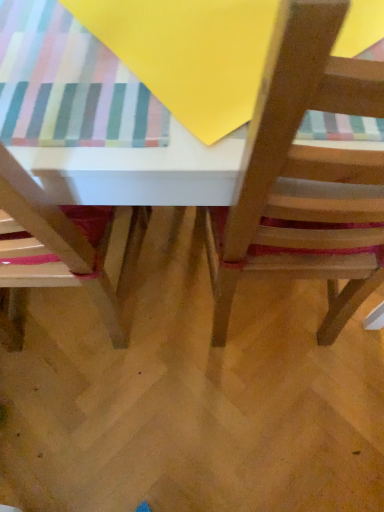
Question: Is wooden table at center taller than wooden chair at center, placed as the second chair when sorted from left to right?

Choices:
 (A) yes
 (B) no

Answer: (B)

Question: Is wooden table at center with wooden chair at center, which is the first chair in right-to-left order?

Choices:
 (A) yes
 (B) no

Answer: (A)

Question: From the image's perspective, is wooden table at center under wooden chair at center, placed as the second chair when sorted from left to right?

Choices:
 (A) no
 (B) yes

Answer: (A)

Question: Is wooden table at center far from wooden chair at center, placed as the second chair when sorted from left to right?

Choices:
 (A) yes
 (B) no

Answer: (B)

Question: From a real-world perspective, is wooden table at center positioned under wooden chair at center, placed as the second chair when sorted from left to right, based on gravity?

Choices:
 (A) no
 (B) yes

Answer: (B)

Question: From a real-world perspective, is wooden chair at center, which is the first chair in right-to-left order, above or below wooden chair at lower left, which is the second chair in right-to-left order?

Choices:
 (A) below
 (B) above

Answer: (B)

Question: From the image's perspective, is wooden chair at center, which is the first chair in right-to-left order, positioned above or below wooden chair at lower left, which appears as the 1th chair when viewed from the left?

Choices:
 (A) above
 (B) below

Answer: (A)

Question: Is wooden chair at center, placed as the second chair when sorted from left to right, inside or outside of wooden chair at lower left, which is the second chair in right-to-left order?

Choices:
 (A) inside
 (B) outside

Answer: (B)

Question: Relative to wooden chair at lower left, which is the second chair in right-to-left order, is wooden chair at center, which is the first chair in right-to-left order, in front or behind?

Choices:
 (A) front
 (B) behind

Answer: (A)

Question: In terms of height, does wooden chair at lower left, which appears as the 1th chair when viewed from the left, look taller or shorter compared to wooden table at center?

Choices:
 (A) short
 (B) tall

Answer: (B)

Question: From the image's perspective, is wooden chair at lower left, which appears as the 1th chair when viewed from the left, above or below wooden table at center?

Choices:
 (A) below
 (B) above

Answer: (A)

Question: Which is correct: wooden chair at lower left, which is the second chair in right-to-left order, is inside wooden table at center, or outside of it?

Choices:
 (A) outside
 (B) inside

Answer: (B)

Question: Considering the relative positions of wooden chair at lower left, which appears as the 1th chair when viewed from the left, and wooden table at center in the image provided, is wooden chair at lower left, which appears as the 1th chair when viewed from the left, to the left or to the right of wooden table at center?

Choices:
 (A) left
 (B) right

Answer: (A)

Question: Is wooden chair at center, placed as the second chair when sorted from left to right, taller or shorter than wooden table at center?

Choices:
 (A) tall
 (B) short

Answer: (A)

Question: Is wooden chair at center, which is the first chair in right-to-left order, bigger or smaller than wooden table at center?

Choices:
 (A) small
 (B) big

Answer: (A)